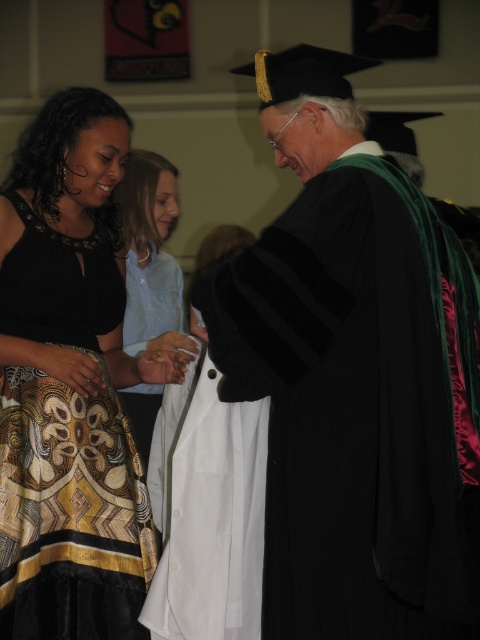
Which is behind, point (351, 593) or point (88, 356)?

Point (88, 356)

Is matte black graduation gown at center positioned in front of patterned fabric dress at lower left?

Yes, it is.

Locate an element on the screen. matte black graduation gown at center is located at coordinates pos(354,376).

Where is `matte black graduation gown at center`? The height and width of the screenshot is (640, 480). matte black graduation gown at center is located at coordinates (354, 376).

Is patterned fabric dress at lower left to the left of light blue shirt at center from the viewer's perspective?

Correct, you'll find patterned fabric dress at lower left to the left of light blue shirt at center.

Which of these two, patterned fabric dress at lower left or light blue shirt at center, stands taller?

patterned fabric dress at lower left

Find the location of a particular element. Image resolution: width=480 pixels, height=640 pixels. patterned fabric dress at lower left is located at coordinates (70, 385).

Who is lower down, matte black graduation gown at center or light blue shirt at center?

matte black graduation gown at center is below.

Is matte black graduation gown at center above light blue shirt at center?

Actually, matte black graduation gown at center is below light blue shirt at center.

Is point (379, 609) closer to viewer compared to point (136, 154)?

Yes, point (379, 609) is in front of point (136, 154).

You are a GUI agent. You are given a task and a screenshot of the screen. Output one action in this format:
    pyautogui.click(x=<x>, y=<y>)
    Task: Click on the matte black graduation gown at center
    
    Given the screenshot: What is the action you would take?
    pyautogui.click(x=354, y=376)